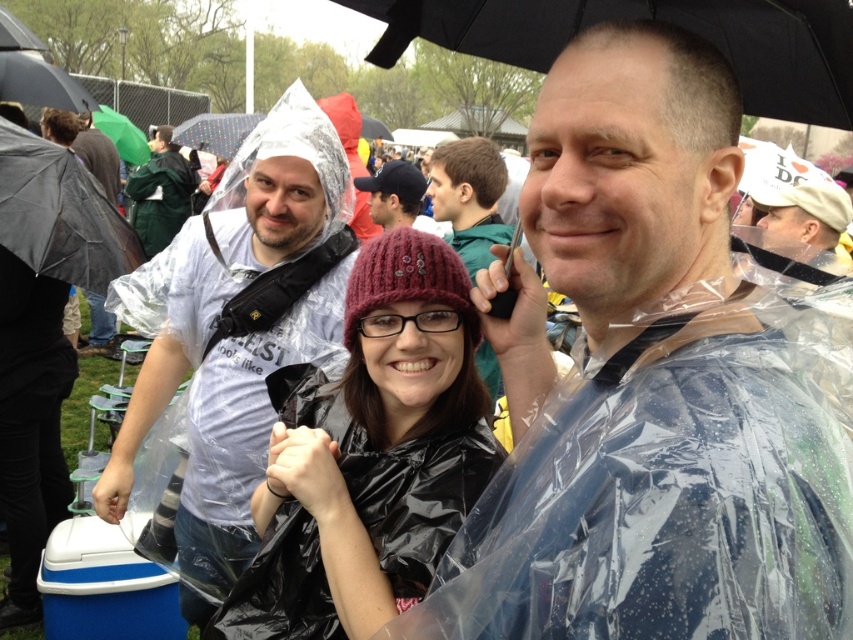
Is black matte umbrella at left smaller than matte black jacket at center?

Correct, black matte umbrella at left occupies less space than matte black jacket at center.

Between black matte umbrella at left and matte black jacket at center, which one appears on the left side from the viewer's perspective?

Positioned to the left is black matte umbrella at left.

Image resolution: width=853 pixels, height=640 pixels. I want to click on black matte umbrella at left, so pyautogui.click(x=59, y=212).

Where is `black matte umbrella at left`? black matte umbrella at left is located at coordinates (59, 212).

Is black matte umbrella at upper center bigger than matte black jacket at center?

Actually, black matte umbrella at upper center might be smaller than matte black jacket at center.

In the scene shown: Does black matte umbrella at upper center come in front of matte black jacket at center?

Yes, it is.

Does point (846, 42) come farther from viewer compared to point (492, 212)?

No, (846, 42) is in front of (492, 212).

At what (x,y) coordinates should I click in order to perform the action: click on black matte umbrella at upper center. Please return your answer as a coordinate pair (x, y). This screenshot has height=640, width=853. Looking at the image, I should click on (660, 20).

Does black matte umbrella at left have a larger size compared to dark gray knit cap at center?

Correct, black matte umbrella at left is larger in size than dark gray knit cap at center.

Is point (76, 177) less distant than point (399, 170)?

That is True.

Locate an element on the screen. black matte umbrella at left is located at coordinates (59, 212).